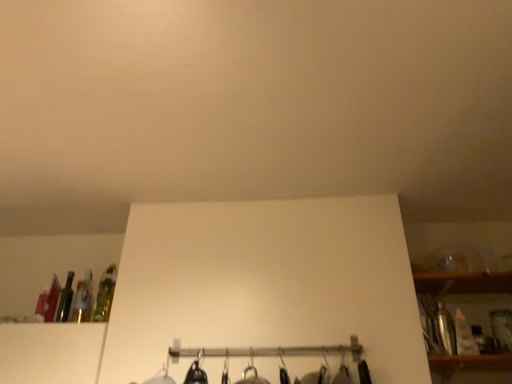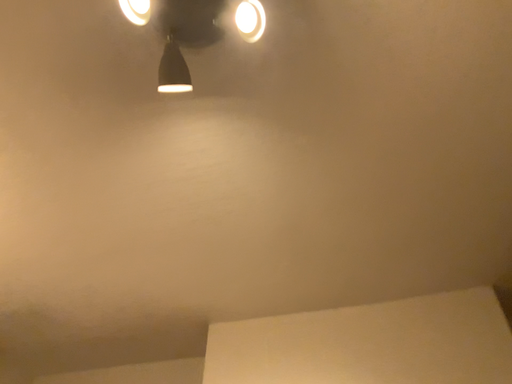
Question: Which way did the camera rotate in the video?

Choices:
 (A) rotated left
 (B) rotated right

Answer: (A)